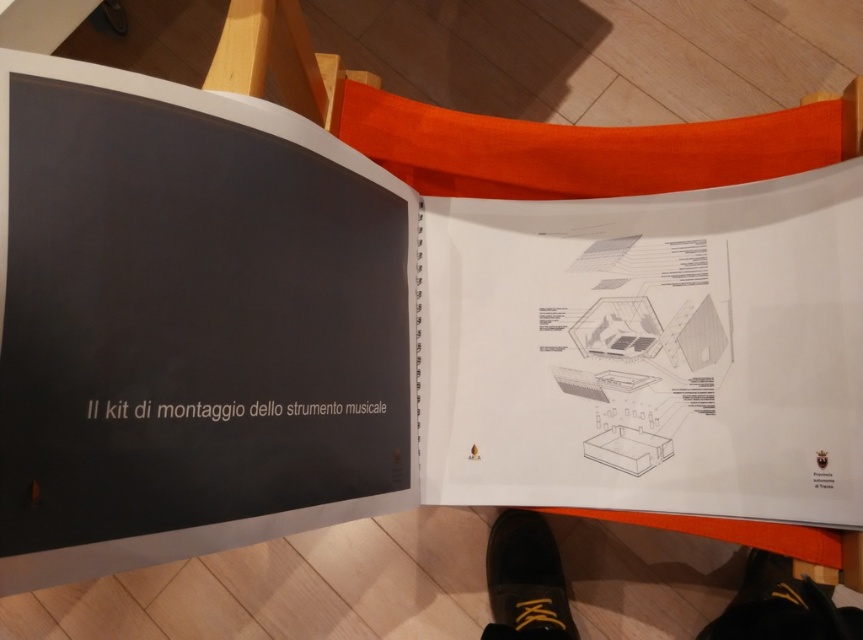
You are standing in a room and see an open book on a wooden surface. The book has technical diagrams and instructions for assembling a musical instrument. There is a point labeled at coordinates (526, 580). What object is located at that point?

The point labeled at coordinates (526, 580) indicates black leather shoes at lower center.

Based on the photo, you are trying to assemble a musical instrument using the open book on the wooden surface. The instructions mention a specific point labeled as point (550, 618). If you need to reach this point with your hand, which is about 12 inches long, can you comfortably reach it without moving the book?

The distance between point (550, 618) and the camera is 37.89 inches. Since your hand is 12 inches long, you cannot comfortably reach the point without moving the book because the distance is greater than the hand length.